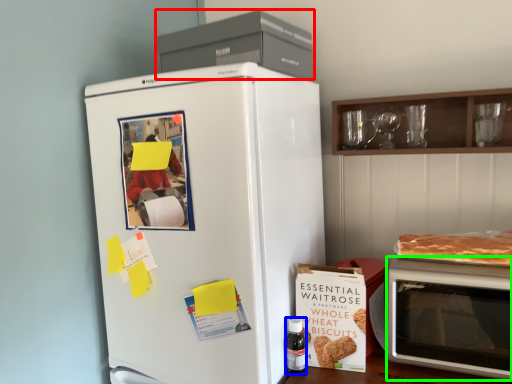
Question: Based on their relative distances, which object is farther from appliance (highlighted by a red box)? Choose from bottle (highlighted by a blue box) and microwave oven (highlighted by a green box).

Choices:
 (A) bottle
 (B) microwave oven

Answer: (A)